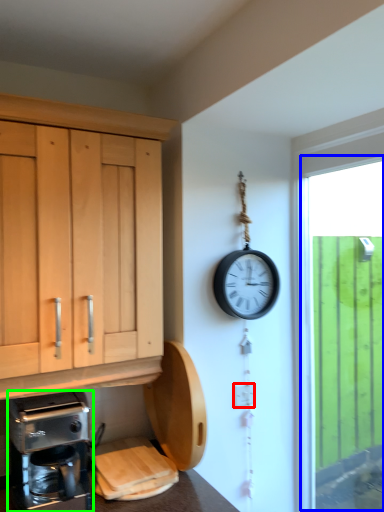
Question: Estimate the real-world distances between objects in this image. Which object is closer to electric outlet (highlighted by a red box), window (highlighted by a blue box) or coffee maker (highlighted by a green box)?

Choices:
 (A) window
 (B) coffee maker

Answer: (B)